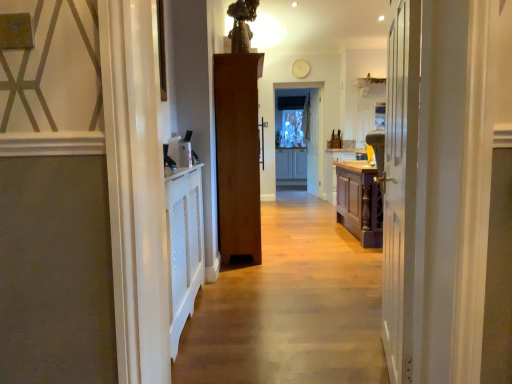
Question: Is clear glass screen door at center taller than brown wooden door at center, marked as the third door in a right-to-left arrangement?

Choices:
 (A) yes
 (B) no

Answer: (A)

Question: Is clear glass screen door at center at the left side of brown wooden door at center, marked as the third door in a right-to-left arrangement?

Choices:
 (A) yes
 (B) no

Answer: (B)

Question: Is clear glass screen door at center outside of brown wooden door at center, marked as the third door in a right-to-left arrangement?

Choices:
 (A) yes
 (B) no

Answer: (A)

Question: Considering the relative sizes of clear glass screen door at center and brown wooden door at center, marked as the third door in a right-to-left arrangement, in the image provided, is clear glass screen door at center bigger than brown wooden door at center, marked as the third door in a right-to-left arrangement,?

Choices:
 (A) yes
 (B) no

Answer: (B)

Question: Is brown wooden door at center, acting as the 1th door starting from the left, a part of clear glass screen door at center?

Choices:
 (A) yes
 (B) no

Answer: (B)

Question: Is clear glass screen door at center taller or shorter than wooden cabinet at center?

Choices:
 (A) short
 (B) tall

Answer: (B)

Question: Considering their positions, is clear glass screen door at center located in front of or behind wooden cabinet at center?

Choices:
 (A) behind
 (B) front

Answer: (A)

Question: From a real-world perspective, is clear glass screen door at center physically located above or below wooden cabinet at center?

Choices:
 (A) above
 (B) below

Answer: (A)

Question: Looking at their shapes, would you say clear glass screen door at center is wider or thinner than wooden cabinet at center?

Choices:
 (A) wide
 (B) thin

Answer: (B)

Question: From the image's perspective, is brown wooden door at center, which is the 2th door from back to front, above or below clear glass screen door at center?

Choices:
 (A) below
 (B) above

Answer: (A)

Question: Is brown wooden door at center, acting as the 1th door starting from the left, taller or shorter than clear glass screen door at center?

Choices:
 (A) short
 (B) tall

Answer: (A)

Question: Is point (246, 69) positioned closer to the camera than point (286, 124)?

Choices:
 (A) farther
 (B) closer

Answer: (B)

Question: In the image, is brown wooden door at center, which is the 2th door from back to front, positioned in front of or behind clear glass screen door at center?

Choices:
 (A) behind
 (B) front

Answer: (B)

Question: From the image's perspective, relative to white wooden door at center, which is counted as the second door, starting from the left, is white wooden door at center, the 1th door viewed from the back, above or below?

Choices:
 (A) below
 (B) above

Answer: (B)

Question: Does point (316, 122) appear closer or farther from the camera than point (399, 276)?

Choices:
 (A) closer
 (B) farther

Answer: (B)